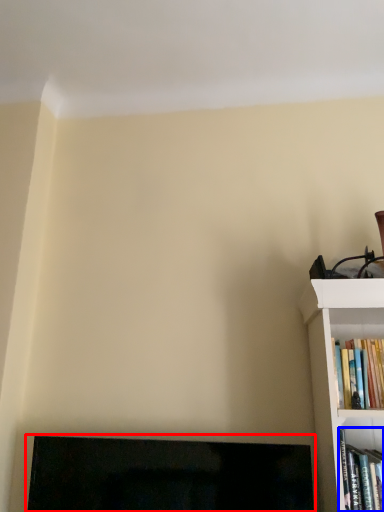
Question: Which of the following is the farthest to the observer, fireplace (highlighted by a red box) or book (highlighted by a blue box)?

Choices:
 (A) fireplace
 (B) book

Answer: (A)